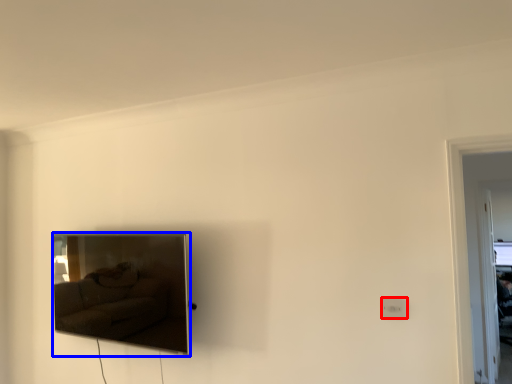
Question: Which point is closer to the camera, electric outlet (highlighted by a red box) or picture frame (highlighted by a blue box)?

Choices:
 (A) electric outlet
 (B) picture frame

Answer: (A)